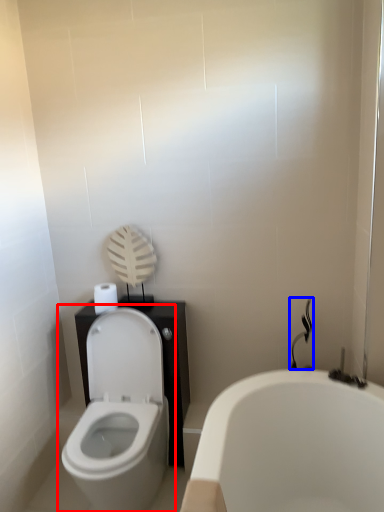
Question: Which of the following is the closest to the observer, toilet (highlighted by a red box) or shower (highlighted by a blue box)?

Choices:
 (A) toilet
 (B) shower

Answer: (A)